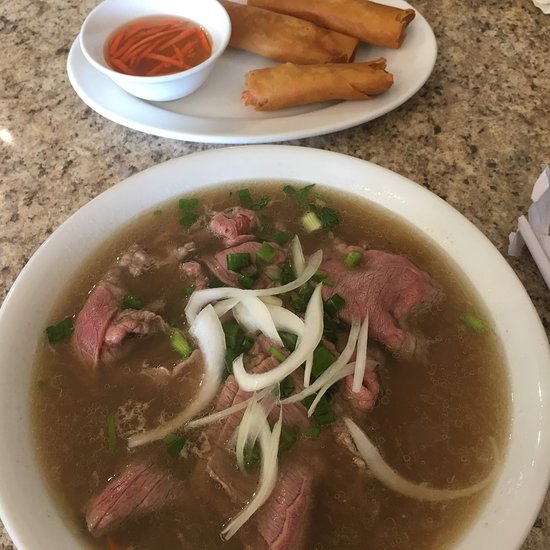
Where is `white sauce bowl`? This screenshot has width=550, height=550. white sauce bowl is located at coordinates (153, 86).